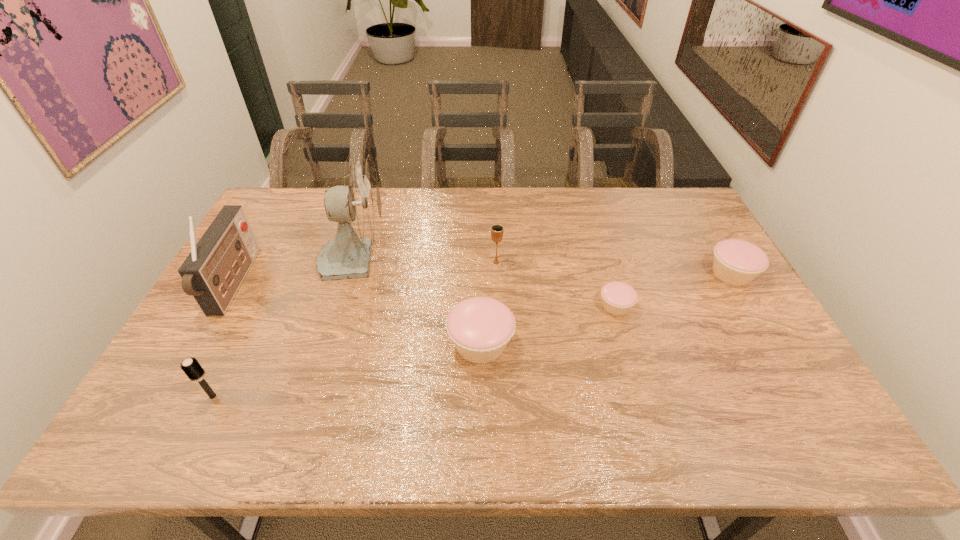
I want to click on hairbrush that is positioned at the near edge, so click(191, 367).

Find the location of a particular element. Image resolution: width=960 pixels, height=540 pixels. radio receiver at the left edge is located at coordinates (212, 273).

Locate an element on the screen. The image size is (960, 540). hairbrush present at the left edge is located at coordinates (191, 367).

Identify the location of object located in the right edge section of the desktop. (736, 262).

Where is `object that is at the near left corner`? The width and height of the screenshot is (960, 540). object that is at the near left corner is located at coordinates (191, 367).

Where is `vacant point at the far edge`? vacant point at the far edge is located at coordinates coord(501,220).

This screenshot has width=960, height=540. Identify the location of free region at the left edge of the desktop. (277, 279).

Where is `vacant area at the right edge`? vacant area at the right edge is located at coordinates (703, 322).

In the image, there is a desktop. Where is `vacant space at the far left corner`? vacant space at the far left corner is located at coordinates [x=277, y=192].

The height and width of the screenshot is (540, 960). What are the coordinates of `free space between the sixth object from right to left and the fan` in the screenshot? It's located at (284, 327).